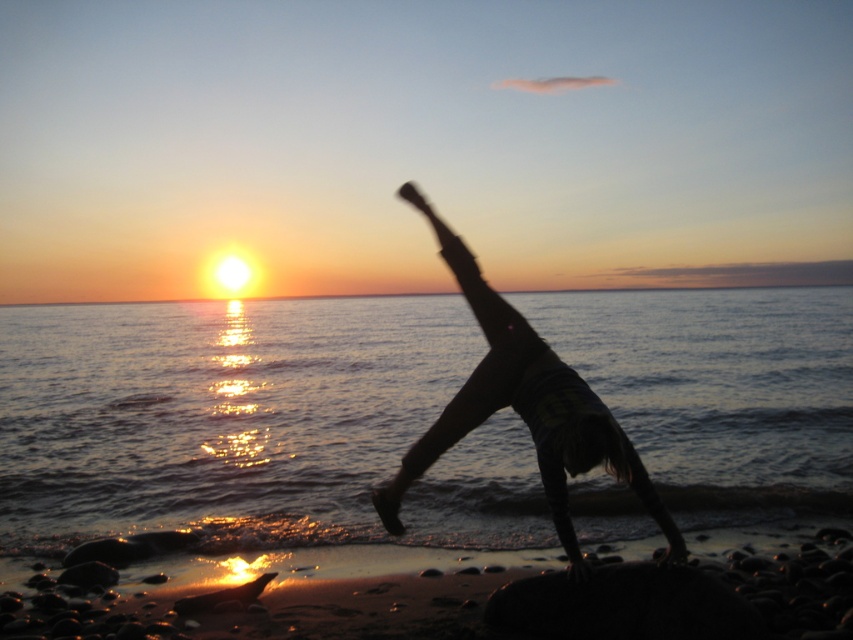
From the picture: You are a photographer trying to capture the silhouette figure at center and the glistening water at sunset right in the same frame. Based on their positions, which object should you adjust your camera focus to first to ensure both are in focus?

The silhouette figure at center is closer to you than the glistening water at sunset right. To ensure both are in focus, adjust your camera focus to the silhouette figure at center first since it is nearer, and the depth of field will naturally include the farther object.